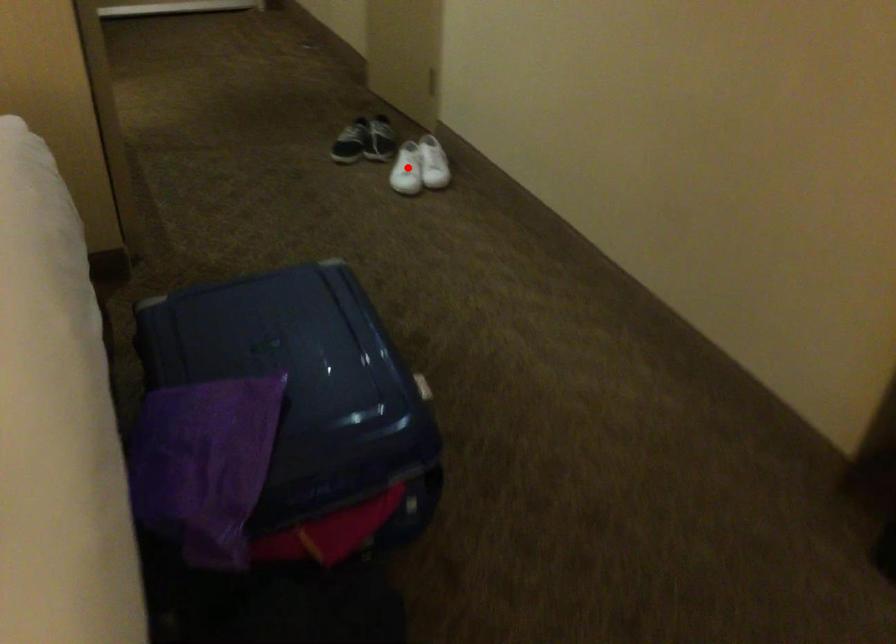
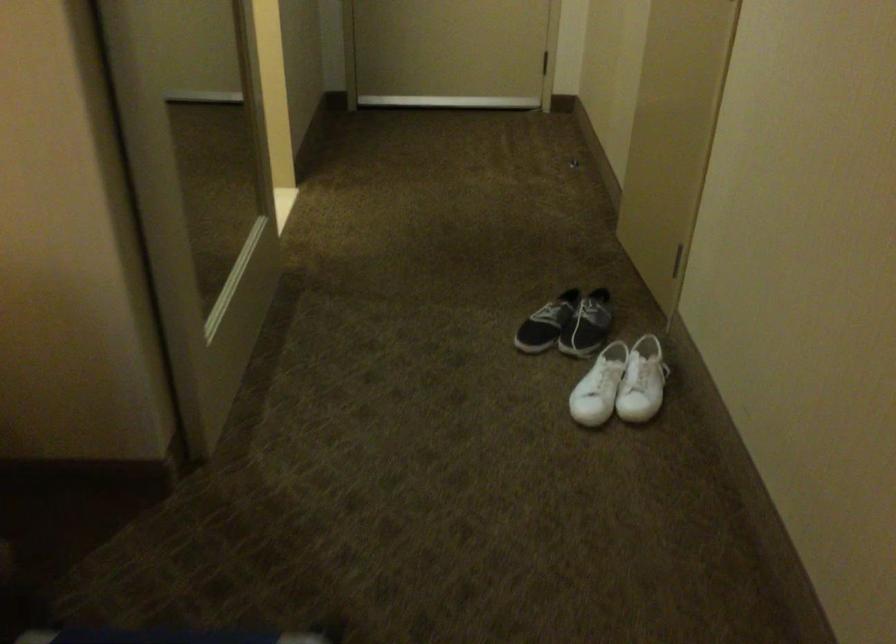
Question: I am providing you with two images of the same scene from different viewpoints. Given a red point in image1, look at the same physical point in image2. Is it:

Choices:
 (A) Closer to the viewpoint
 (B) Farther from the viewpoint

Answer: (A)